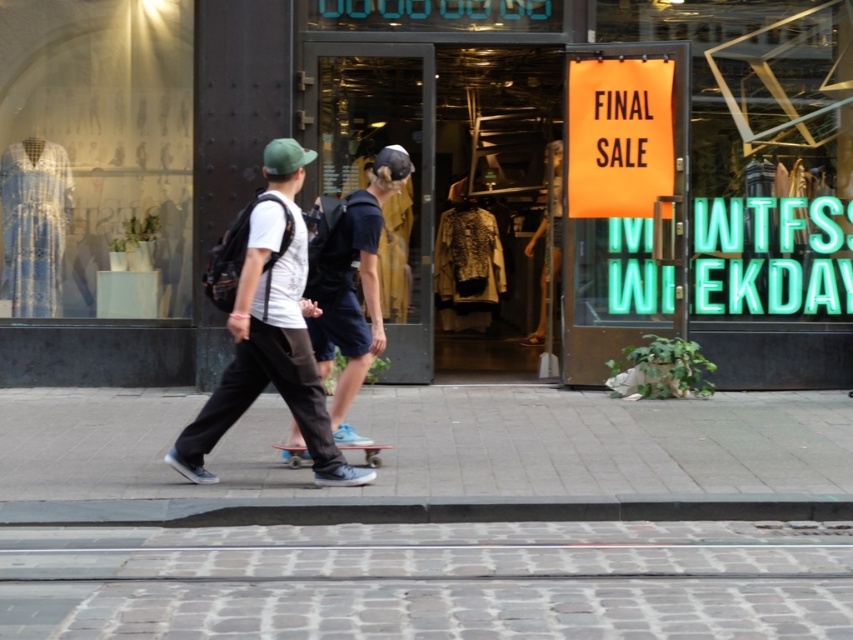
You are a delivery person with a matte black skateboard at center that is 60 cm wide. You want to hang a matte black sign at center on the wall. Can the sign fit horizontally if the skateboard is placed next to it?

The matte black sign at center is narrower than the matte black skateboard at center, so the sign will fit horizontally since it is narrower than the skateboard.

You are a delivery person trying to deliver a package to the store. The package requires a signature, so you need to approach the entrance. However, there is a matte black sign at center and a light blue deck at center blocking your path. Which object should you move around first to reach the entrance?

The matte black sign at center is smaller than the light blue deck at center, so you should move around the light blue deck at center first since it is larger and more likely to be in your way.

Consider the image. You are a delivery person trying to deliver a package to the store entrance. You have a matte black sign at center and a matte black skateboard at center. Which item can you place vertically without it exceeding the height of the store entrance?

The matte black skateboard at center can be placed vertically without exceeding the height of the store entrance because it is taller than the matte black sign at center, which is shorter and might not reach the required height.